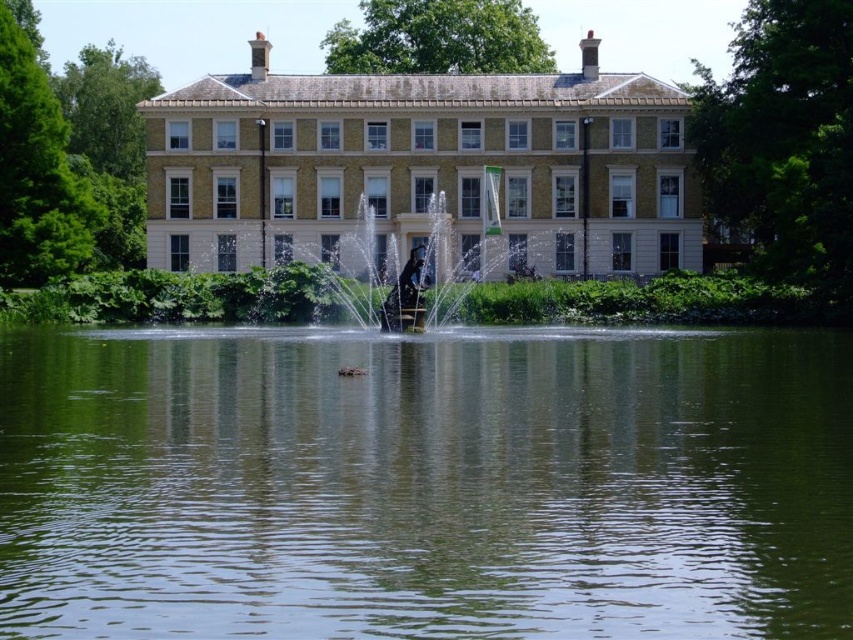
Based on the coordinates provided, can you identify which object is located at point (421, 166) in the scene?

The beige stone mansion at center is located at point (421, 166).